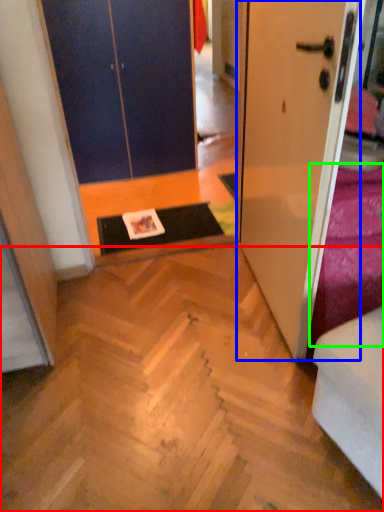
Question: Which is nearer to the stairwell (highlighted by a red box)? door (highlighted by a blue box) or bedding (highlighted by a green box).

Choices:
 (A) door
 (B) bedding

Answer: (B)